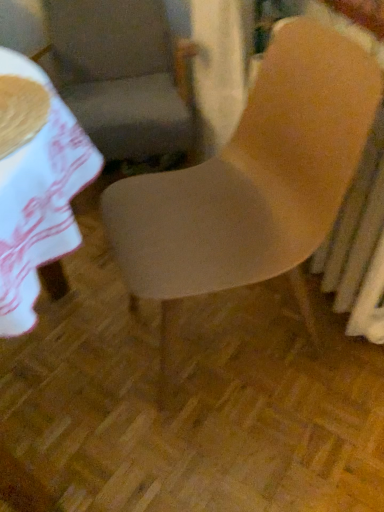
Question: Considering the positions of matte wood chair at center, which appears as the 1th chair when viewed from the front, and matte gray chair at center, which is the second chair in front-to-back order, in the image, is matte wood chair at center, which appears as the 1th chair when viewed from the front, taller or shorter than matte gray chair at center, which is the second chair in front-to-back order,?

Choices:
 (A) tall
 (B) short

Answer: (A)

Question: From a real-world perspective, is matte wood chair at center, the second chair positioned from the back, physically located above or below matte gray chair at center, which is the second chair in front-to-back order?

Choices:
 (A) above
 (B) below

Answer: (A)

Question: Would you say matte wood chair at center, the second chair positioned from the back, is to the left or to the right of matte gray chair at center, which is the second chair in front-to-back order, in the picture?

Choices:
 (A) right
 (B) left

Answer: (A)

Question: Based on their sizes in the image, would you say matte gray chair at center, which is the 1th chair in back-to-front order, is bigger or smaller than matte wood chair at center, the second chair positioned from the back?

Choices:
 (A) big
 (B) small

Answer: (A)

Question: Do you think matte gray chair at center, which is the second chair in front-to-back order, is within matte wood chair at center, the second chair positioned from the back, or outside of it?

Choices:
 (A) outside
 (B) inside

Answer: (A)

Question: From a real-world perspective, relative to matte wood chair at center, which appears as the 1th chair when viewed from the front, is matte gray chair at center, which is the second chair in front-to-back order, vertically above or below?

Choices:
 (A) below
 (B) above

Answer: (A)

Question: Considering the positions of matte gray chair at center, which is the 1th chair in back-to-front order, and matte wood chair at center, the second chair positioned from the back, in the image, is matte gray chair at center, which is the 1th chair in back-to-front order, wider or thinner than matte wood chair at center, the second chair positioned from the back,?

Choices:
 (A) wide
 (B) thin

Answer: (A)